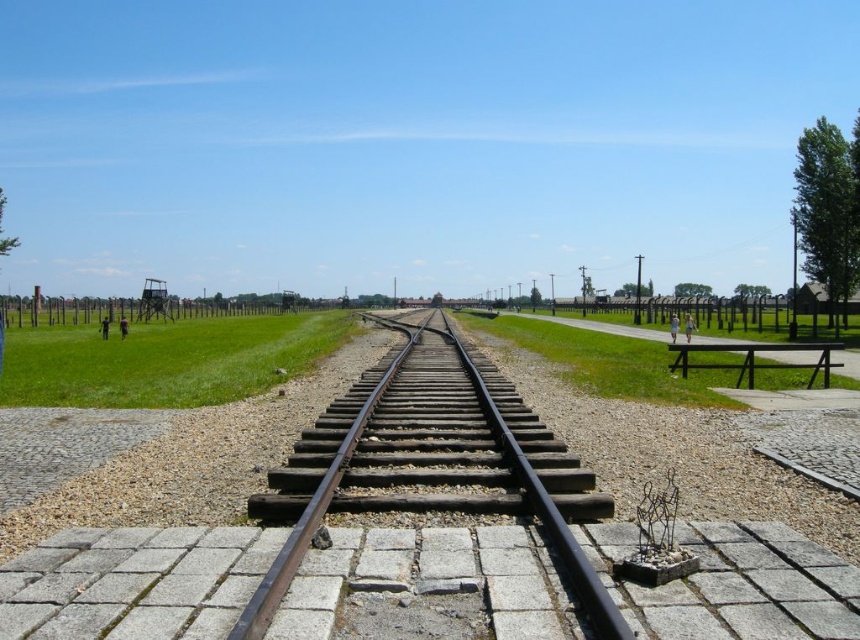
Question: Can you confirm if green grass at center is wider than black wood park bench at lower right?

Choices:
 (A) no
 (B) yes

Answer: (A)

Question: Estimate the real-world distances between objects in this image. Which object is closer to the black wood park bench at lower right?

Choices:
 (A) black metal train track at center
 (B) green grass at center

Answer: (A)

Question: Is green grass at center above black metal train track at center?

Choices:
 (A) no
 (B) yes

Answer: (A)

Question: Which of the following is the farthest from the observer?

Choices:
 (A) (126, 572)
 (B) (752, 368)

Answer: (B)

Question: Is green grass at center closer to camera compared to black wood park bench at lower right?

Choices:
 (A) no
 (B) yes

Answer: (B)

Question: Among these objects, which one is nearest to the camera?

Choices:
 (A) black wood park bench at lower right
 (B) green grass at center

Answer: (B)